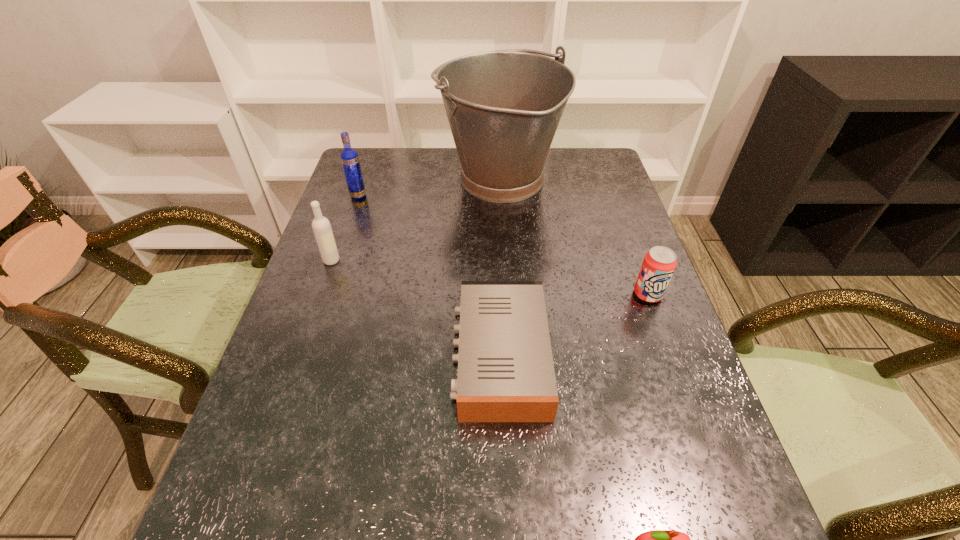
Identify the location of the tallest object. This screenshot has width=960, height=540. (503, 107).

What are the coordinates of `the farther vodka` in the screenshot? It's located at (349, 157).

The height and width of the screenshot is (540, 960). I want to click on the nearer vodka, so click(x=321, y=226).

Locate an element on the screen. Image resolution: width=960 pixels, height=540 pixels. the fourth tallest object is located at coordinates (658, 266).

You are a GUI agent. You are given a task and a screenshot of the screen. Output one action in this format:
    pyautogui.click(x=<x>, y=<y>)
    Task: Click on the soda can
    This screenshot has height=540, width=960.
    Given the screenshot: What is the action you would take?
    pyautogui.click(x=658, y=266)

Where is `the shortest object`? This screenshot has width=960, height=540. the shortest object is located at coordinates (506, 373).

At what (x,y) coordinates should I click in order to perform the action: click on free space located 0.140m on the left of the bucket. Please return your answer as a coordinate pair (x, y). Looking at the image, I should click on tap(395, 180).

Where is `free space located 0.120m on the back of the farther vodka`? This screenshot has width=960, height=540. free space located 0.120m on the back of the farther vodka is located at coordinates (367, 171).

The width and height of the screenshot is (960, 540). In order to click on free space located 0.190m on the back of the nearer vodka in this screenshot , I will do `click(348, 212)`.

Locate an element on the screen. vacant space situated on the surface of the fourth tallest object is located at coordinates (665, 343).